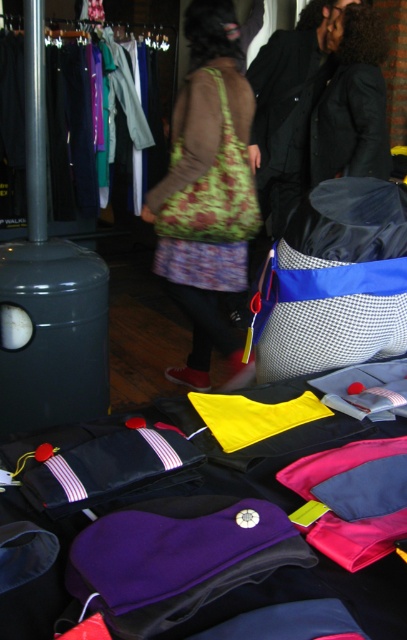
You are a customer in the store looking to purchase a bag and a jacket. You want to place both items on the table in front of you. Given the space available, will both the blue and white checkered bag at center and the black leather jacket at upper right fit on the table without overlapping?

The blue and white checkered bag at center occupies less space than the black leather jacket at upper right. However, since the table has folded garments displayed on it, there might not be enough space to accommodate both items without overlapping. Please check the available space on the table before placing them.

From the picture: You are a customer in the store and want to pick up both the blue and white checkered bag at center and the black wool coat at upper right. Which item should you reach for first to grab the one closer to you?

The blue and white checkered bag at center is closer to the viewer than the black wool coat at upper right, so you should reach for the blue and white checkered bag at center first.

You are a customer in the store and want to pick up both the blue and white checkered bag at center and the black leather jacket at upper right. How far apart are these two items?

The blue and white checkered bag at center and the black leather jacket at upper right are 5.07 feet apart.